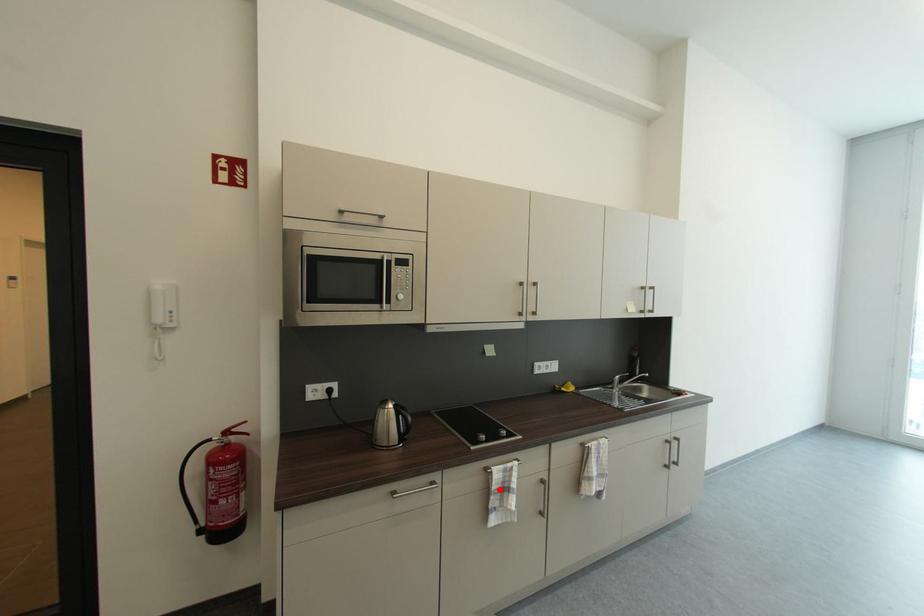
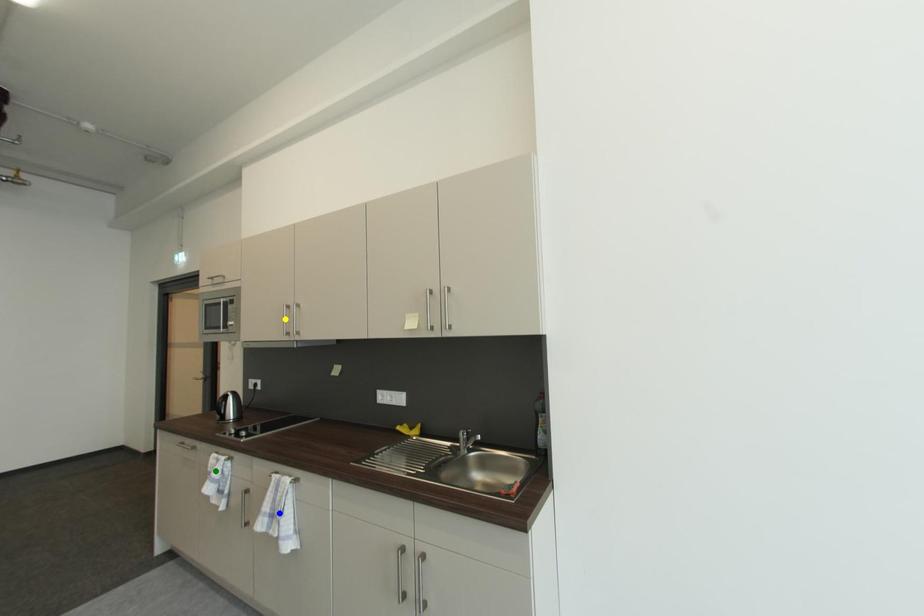
Question: I am providing you with two images of the same scene from different viewpoints. A red point is marked on the first image. You are given multiple points on the second image. Which mark in image 2 goes with the point in image 1?

Choices:
 (A) green point
 (B) yellow point
 (C) blue point

Answer: (A)